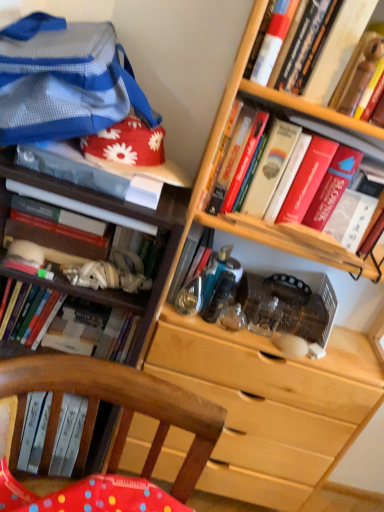
Describe the element at coordinates (309, 108) in the screenshot. The image size is (384, 512). I see `hardcover book at upper right, which is the eighth book from left to right` at that location.

Where is `hardcover book at left, arranged as the 9th book when viewed from the right`? hardcover book at left, arranged as the 9th book when viewed from the right is located at coordinates (44, 318).

Measure the distance between hardcover book at upper right, which is counted as the 1th book, starting from the right, and camera.

hardcover book at upper right, which is counted as the 1th book, starting from the right, and camera are 33.56 inches apart.

What do you see at coordinates (358, 72) in the screenshot? I see `hardcover book at upper right, which is the ninth book in left-to-right order` at bounding box center [358, 72].

At what (x,y) coordinates should I click in order to perform the action: click on hardcover book at upper right, the second book positioned from the right. Please return your answer as a coordinate pair (x, y). The width and height of the screenshot is (384, 512). Looking at the image, I should click on (309, 108).

Between hardcover book at left, the first book from the left, and blue striped fabric at upper left, which one is positioned behind?

hardcover book at left, the first book from the left, is further away from the camera.

Are hardcover book at left, arranged as the 9th book when viewed from the right, and blue striped fabric at upper left located far from each other?

No, hardcover book at left, arranged as the 9th book when viewed from the right, is not far away from blue striped fabric at upper left.

Is hardcover book at left, the first book from the left, smaller than blue striped fabric at upper left?

Correct, hardcover book at left, the first book from the left, occupies less space than blue striped fabric at upper left.

Is blue striped fabric at upper left at the back of hardcover book at left, arranged as the 9th book when viewed from the right?

No, hardcover book at left, arranged as the 9th book when viewed from the right, is not facing away from blue striped fabric at upper left.

Is hardcover book at upper right, the 3th book in the right-to-left sequence, at the back of blue striped fabric at upper left?

No, blue striped fabric at upper left's orientation is not away from hardcover book at upper right, the 3th book in the right-to-left sequence.

Is blue striped fabric at upper left shorter than hardcover book at upper right, which ranks as the 7th book in left-to-right order?

No, blue striped fabric at upper left is not shorter than hardcover book at upper right, which ranks as the 7th book in left-to-right order.

Is blue striped fabric at upper left surrounding hardcover book at upper right, which ranks as the 7th book in left-to-right order?

No, blue striped fabric at upper left does not contain hardcover book at upper right, which ranks as the 7th book in left-to-right order.

From the image's perspective, which one is positioned higher, blue striped fabric at upper left or hardcover book at upper right, which ranks as the 7th book in left-to-right order?

blue striped fabric at upper left is shown above in the image.

Is metallic blue book at center, which appears as the 5th book when viewed from the right, at the right side of matte white book at upper left, acting as the 6th book starting from the right?

Indeed, metallic blue book at center, which appears as the 5th book when viewed from the right, is positioned on the right side of matte white book at upper left, acting as the 6th book starting from the right.

In the image, is metallic blue book at center, which appears as the 5th book when viewed from the right, positioned in front of or behind matte white book at upper left, acting as the 6th book starting from the right?

In the image, metallic blue book at center, which appears as the 5th book when viewed from the right, appears behind matte white book at upper left, acting as the 6th book starting from the right.

Between point (188, 254) and point (43, 148), which one is positioned behind?

The point (188, 254) is farther.

In the scene shown: Which of these two, metallic blue book at center, which ranks as the fifth book in left-to-right order, or matte white book at upper left, acting as the 6th book starting from the right, stands shorter?

matte white book at upper left, acting as the 6th book starting from the right.

Is hardcover book at upper right, which is counted as the 1th book, starting from the right, far from hardcover book at center-left, the 8th book in the right-to-left sequence?

No, hardcover book at upper right, which is counted as the 1th book, starting from the right, is not far from hardcover book at center-left, the 8th book in the right-to-left sequence.

Is point (369, 75) behind point (114, 265)?

No, (369, 75) is closer to viewer.

Considering the sizes of hardcover book at upper right, which is counted as the 1th book, starting from the right, and hardcover book at center-left, the 8th book in the right-to-left sequence, in the image, is hardcover book at upper right, which is counted as the 1th book, starting from the right, taller or shorter than hardcover book at center-left, the 8th book in the right-to-left sequence,?

hardcover book at upper right, which is counted as the 1th book, starting from the right, is shorter than hardcover book at center-left, the 8th book in the right-to-left sequence.

How distant is hardcover book at upper right, which is counted as the 1th book, starting from the right, from hardcover book at center-left, the 8th book in the right-to-left sequence?

hardcover book at upper right, which is counted as the 1th book, starting from the right, and hardcover book at center-left, the 8th book in the right-to-left sequence, are 22.97 inches apart from each other.

From the image's perspective, relative to matte white book at upper left, the fourth book viewed from the left, is hardcover book at left, positioned as the 7th book in right-to-left order, above or below?

Clearly, from the image's perspective, hardcover book at left, positioned as the 7th book in right-to-left order, is below matte white book at upper left, the fourth book viewed from the left.

From the image's perspective, which book is the 2nd one above the hardcover book at left, positioned as the 7th book in right-to-left order? Please provide its 2D coordinates.

[(88, 172)]

Looking at this image, which object is positioned more to the right, hardcover book at left, positioned as the 7th book in right-to-left order, or matte white book at upper left, acting as the 6th book starting from the right?

From the viewer's perspective, matte white book at upper left, acting as the 6th book starting from the right, appears more on the right side.

Does matte white book at upper left, acting as the 6th book starting from the right, have a lesser height compared to hardcover book at center-left, which appears as the 2th book when viewed from the left?

Correct, matte white book at upper left, acting as the 6th book starting from the right, is not as tall as hardcover book at center-left, which appears as the 2th book when viewed from the left.

How different are the orientations of matte white book at upper left, acting as the 6th book starting from the right, and hardcover book at center-left, the 8th book in the right-to-left sequence, in degrees?

The facing directions of matte white book at upper left, acting as the 6th book starting from the right, and hardcover book at center-left, the 8th book in the right-to-left sequence, are 0.0846 degrees apart.

How far apart are matte white book at upper left, the fourth book viewed from the left, and hardcover book at center-left, the 8th book in the right-to-left sequence?

matte white book at upper left, the fourth book viewed from the left, and hardcover book at center-left, the 8th book in the right-to-left sequence, are 4.59 inches apart from each other.

Is the position of matte white book at upper left, acting as the 6th book starting from the right, less distant than that of hardcover book at center-left, which appears as the 2th book when viewed from the left?

Yes, it is.

Which object is closer to the camera, white matte book at upper right, positioned as the 4th book in right-to-left order, or metallic blue book at center, which ranks as the fifth book in left-to-right order?

white matte book at upper right, positioned as the 4th book in right-to-left order.

From the image's perspective, is white matte book at upper right, positioned as the 4th book in right-to-left order, under metallic blue book at center, which ranks as the fifth book in left-to-right order?

No.

Would you say white matte book at upper right, the 6th book when ordered from left to right, is inside or outside metallic blue book at center, which appears as the 5th book when viewed from the right?

white matte book at upper right, the 6th book when ordered from left to right, is outside metallic blue book at center, which appears as the 5th book when viewed from the right.

Where is `clothing located on the right of hardcover book at left, the first book from the left`? This screenshot has width=384, height=512. clothing located on the right of hardcover book at left, the first book from the left is located at coordinates (64, 80).

Locate an element on the screen. This screenshot has width=384, height=512. clothing above the hardcover book at upper right, which ranks as the 7th book in left-to-right order (from the image's perspective) is located at coordinates (64, 80).

Considering their positions, is hardcover book at upper right, which is the eighth book from left to right, positioned further to hardcover book at upper right, which is counted as the 1th book, starting from the right, than metallic blue book at center, which appears as the 5th book when viewed from the right?

metallic blue book at center, which appears as the 5th book when viewed from the right, is positioned further to the anchor hardcover book at upper right, which is counted as the 1th book, starting from the right.

Which object lies further to the anchor point white matte book at upper right, positioned as the 4th book in right-to-left order, hardcover book at center-left, the 8th book in the right-to-left sequence, or hardcover book at left, the first book from the left?

Based on the image, hardcover book at left, the first book from the left, appears to be further to white matte book at upper right, positioned as the 4th book in right-to-left order.

Which object lies further to the anchor point hardcover book at left, positioned as the 7th book in right-to-left order, hardcover book at center-left, the 8th book in the right-to-left sequence, or blue striped fabric at upper left?

Based on the image, blue striped fabric at upper left appears to be further to hardcover book at left, positioned as the 7th book in right-to-left order.

Looking at the image, which one is located closer to hardcover book at left, which is the 3th book in left-to-right order, hardcover book at upper right, the 3th book in the right-to-left sequence, or hardcover book at upper right, which is the eighth book from left to right?

The object closer to hardcover book at left, which is the 3th book in left-to-right order, is hardcover book at upper right, the 3th book in the right-to-left sequence.

Based on their spatial positions, is hardcover book at left, the first book from the left, or hardcover book at upper right, which is the eighth book from left to right, further from matte white book at upper left, the fourth book viewed from the left?

Among the two, hardcover book at left, the first book from the left, is located further to matte white book at upper left, the fourth book viewed from the left.

Which object lies nearer to the anchor point blue striped fabric at upper left, white matte book at upper right, positioned as the 4th book in right-to-left order, or hardcover book at upper right, which is counted as the 1th book, starting from the right?

Based on the image, white matte book at upper right, positioned as the 4th book in right-to-left order, appears to be nearer to blue striped fabric at upper left.

Considering their positions, is hardcover book at upper right, the second book positioned from the right, positioned further to matte white book at upper left, the fourth book viewed from the left, than hardcover book at center-left, which appears as the 2th book when viewed from the left?

Based on the image, hardcover book at upper right, the second book positioned from the right, appears to be further to matte white book at upper left, the fourth book viewed from the left.

Which object lies further to the anchor point hardcover book at center-left, the 8th book in the right-to-left sequence, white matte book at upper right, the 6th book when ordered from left to right, or metallic blue book at center, which appears as the 5th book when viewed from the right?

Based on the image, white matte book at upper right, the 6th book when ordered from left to right, appears to be further to hardcover book at center-left, the 8th book in the right-to-left sequence.

Where is `clothing located between hardcover book at left, the first book from the left, and hardcover book at upper right, which is the eighth book from left to right, in the left-right direction`? clothing located between hardcover book at left, the first book from the left, and hardcover book at upper right, which is the eighth book from left to right, in the left-right direction is located at coordinates (64, 80).

You are a GUI agent. You are given a task and a screenshot of the screen. Output one action in this format:
    pyautogui.click(x=<x>, y=<y>)
    Task: Click on the clothing between hardcover book at left, which is the 3th book in left-to-right order, and white matte book at upper right, the 6th book when ordered from left to right
    
    Given the screenshot: What is the action you would take?
    pyautogui.click(x=64, y=80)

I want to click on clothing located between hardcover book at center-left, the 8th book in the right-to-left sequence, and hardcover book at upper right, which is the ninth book in left-to-right order, in the left-right direction, so click(64, 80).

Locate an element on the screen. The width and height of the screenshot is (384, 512). clothing between white matte book at upper right, positioned as the 4th book in right-to-left order, and hardcover book at left, arranged as the 9th book when viewed from the right, vertically is located at coordinates (64, 80).